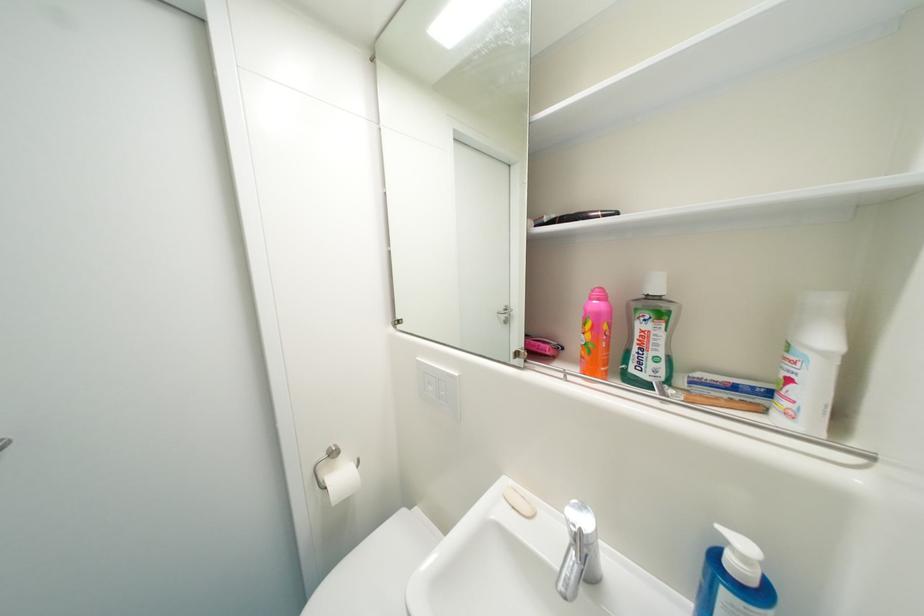
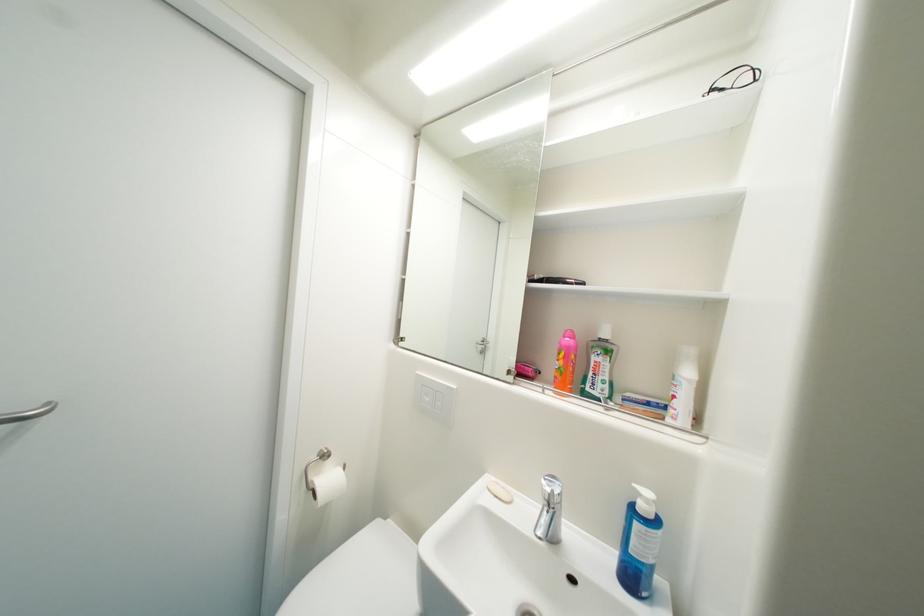
In the second image, find the point that corresponds to the point at 520,509 in the first image.

(503, 498)